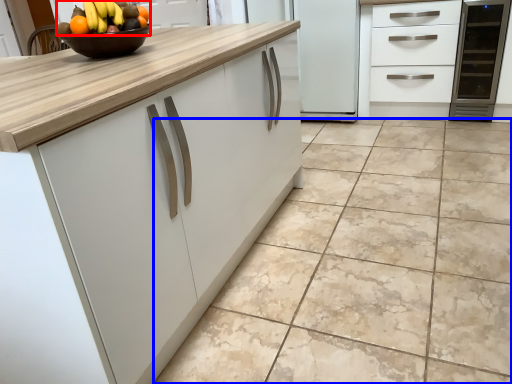
Question: Which of the following is the closest to the observer, grapefruit (highlighted by a red box) or ceramic tile (highlighted by a blue box)?

Choices:
 (A) grapefruit
 (B) ceramic tile

Answer: (B)